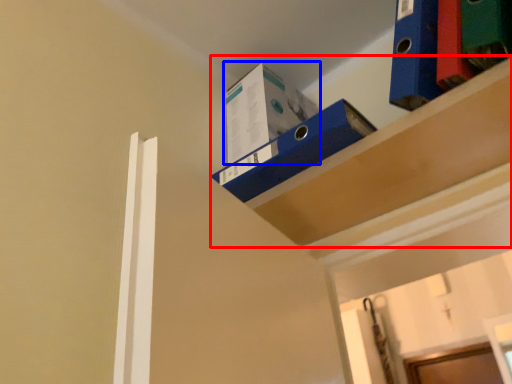
Question: Which object is further to the camera taking this photo, shelf (highlighted by a red box) or box (highlighted by a blue box)?

Choices:
 (A) shelf
 (B) box

Answer: (B)